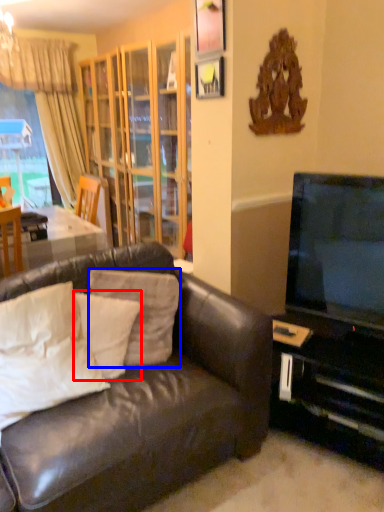
Question: Which object is further to the camera taking this photo, pillow (highlighted by a red box) or pillow (highlighted by a blue box)?

Choices:
 (A) pillow
 (B) pillow

Answer: (B)